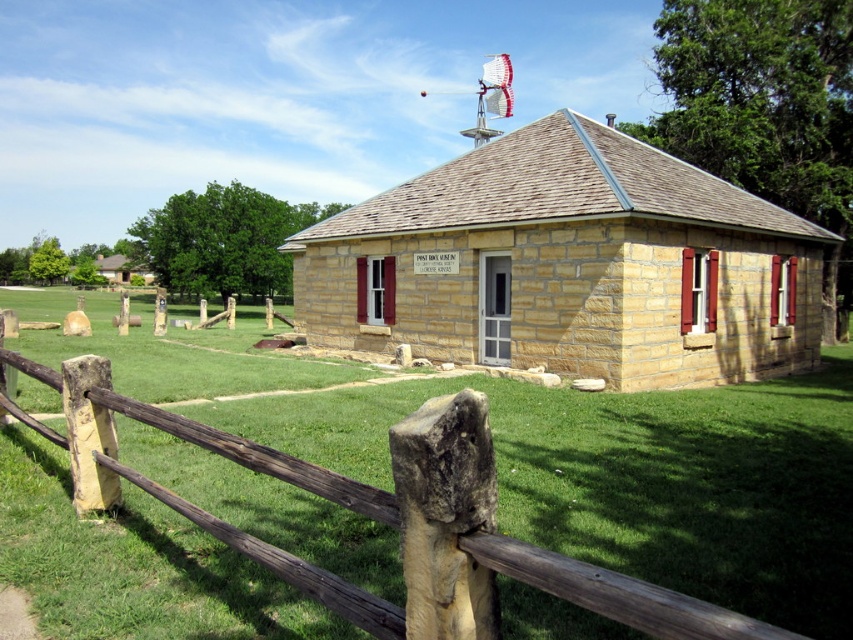
You are a delivery person who needs to park your delivery van, which is 6 meters long, between the brown stone building at center and the brown wooden fence at lower left. Is there enough space for the van to fit between them?

The distance between the brown stone building at center and the brown wooden fence at lower left is 13.72 meters, which is longer than the van length of 6 meters. Therefore, the van can fit between them.